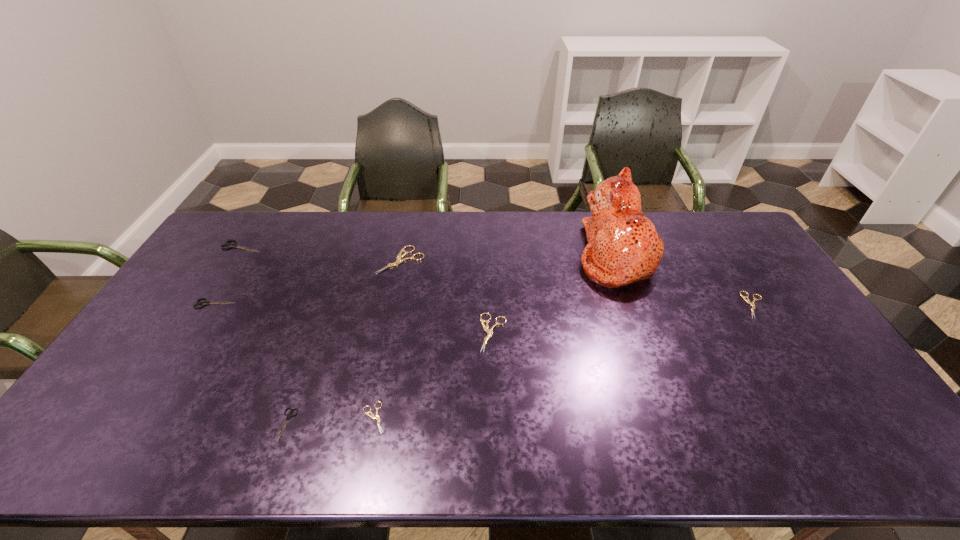
Locate an element on the screen. This screenshot has height=540, width=960. free location that satisfies the following two spatial constraints: 1. on the front side of the shortest object; 2. on the right side of the farthest black shears is located at coordinates (132, 418).